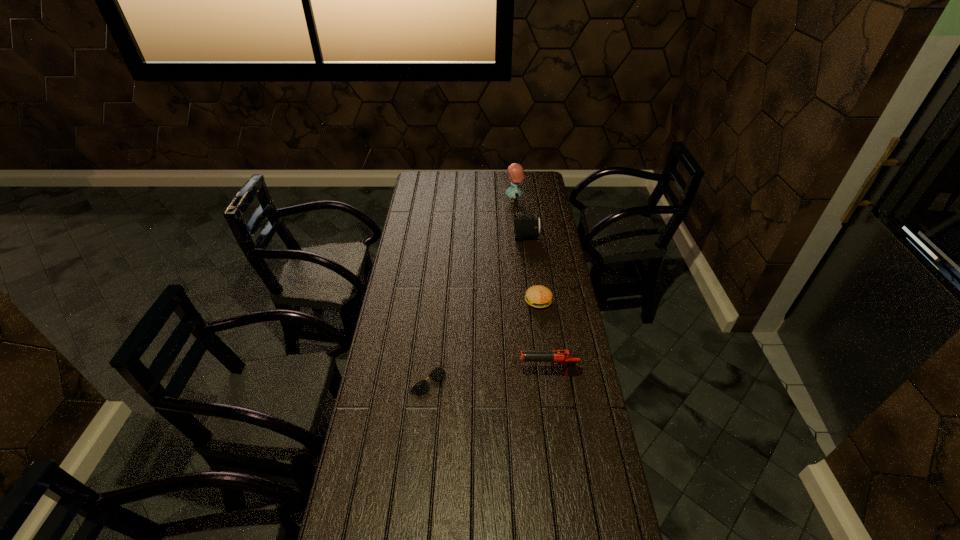
The image size is (960, 540). I want to click on the farthest object, so click(516, 173).

Where is `the tallest object`? This screenshot has width=960, height=540. the tallest object is located at coordinates (516, 173).

The height and width of the screenshot is (540, 960). Identify the location of telephoto lens. (526, 225).

At what (x,y) coordinates should I click in order to perform the action: click on gun. Please return your answer as a coordinate pair (x, y). The height and width of the screenshot is (540, 960). Looking at the image, I should click on (564, 357).

Locate an element on the screen. The image size is (960, 540). the third nearest object is located at coordinates (538, 296).

Locate an element on the screen. The width and height of the screenshot is (960, 540). patty is located at coordinates (538, 296).

Locate an element on the screen. This screenshot has height=540, width=960. spectacles is located at coordinates (421, 387).

You are a GUI agent. You are given a task and a screenshot of the screen. Output one action in this format:
    pyautogui.click(x=<x>, y=<y>)
    Task: Click on the shortest object
    The height and width of the screenshot is (540, 960).
    Given the screenshot: What is the action you would take?
    pyautogui.click(x=421, y=387)

Find the location of a particular element. Image resolution: width=960 pixels, height=540 pixels. vacant region located 0.060m on the front-facing side of the doll is located at coordinates click(493, 200).

Locate an element on the screen. free space located on the front-facing side of the doll is located at coordinates (466, 200).